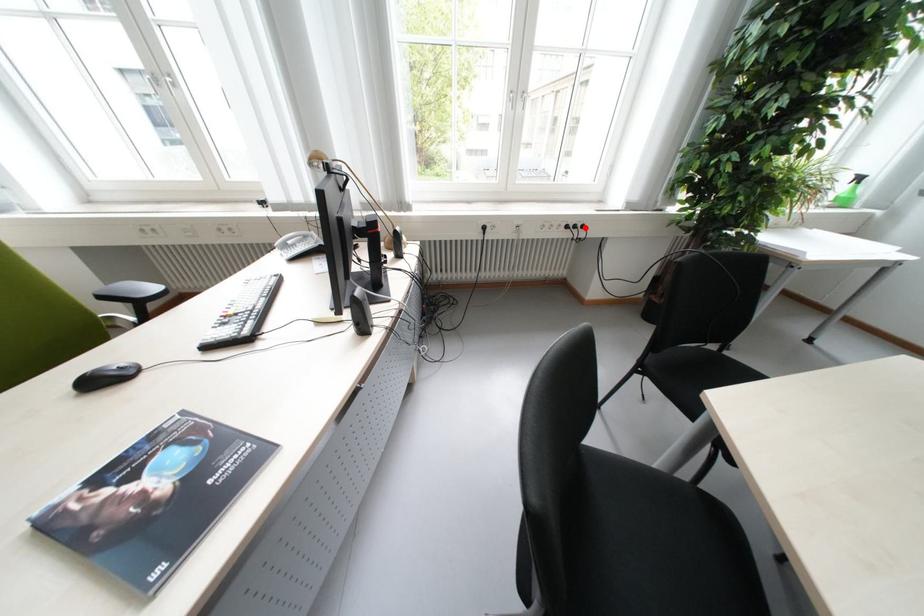
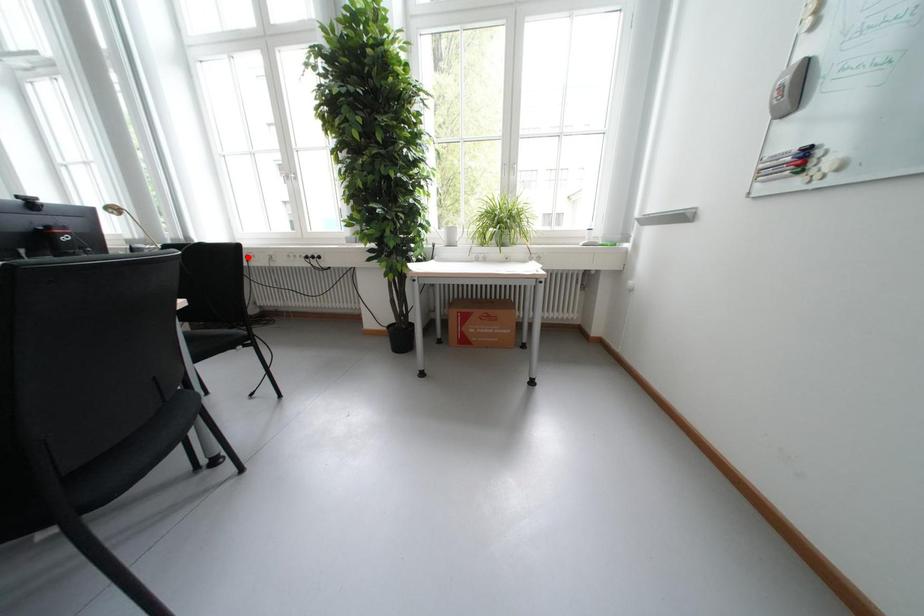
I am providing you with two images of the same scene from different viewpoints. A red point is marked on the first image and another point is marked on the second image. Are the points marked in image1 and image2 representing the same 3D position?

No